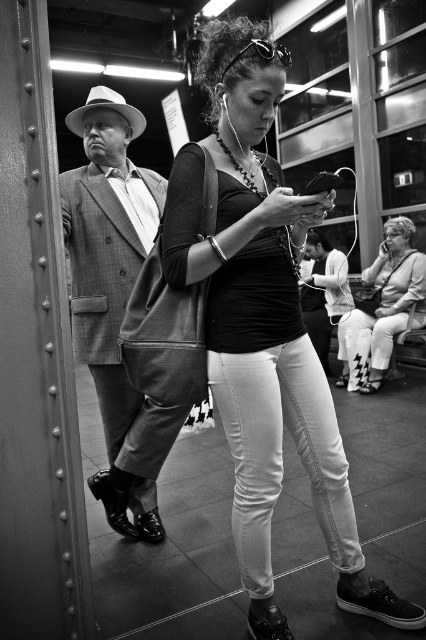
Consider the image. You are a fashion designer observing a subway scene. You notice two individuals wearing different outfits. The first is wearing a matte black shirt at center, and the second is wearing a plaid wool suit at left. Which outfit takes up more space in the photo?

The matte black shirt at center takes up more space in the photo because its width surpasses that of the plaid wool suit at left.

You are standing in the subway car and want to know where the matte black shirt at center is located. Can you describe its position using coordinates?

The matte black shirt at center is located at coordinates point [264,326].